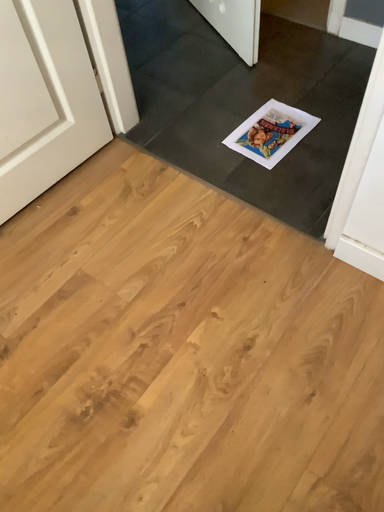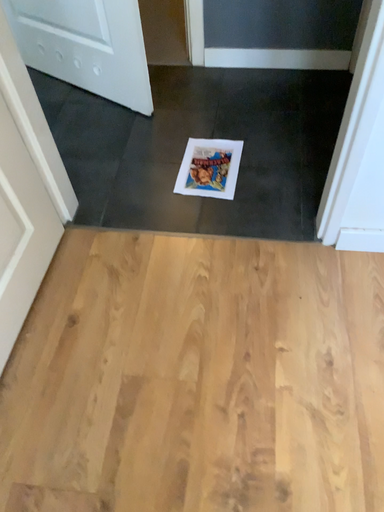
Question: Which way did the camera rotate in the video?

Choices:
 (A) rotated upward
 (B) rotated downward

Answer: (A)